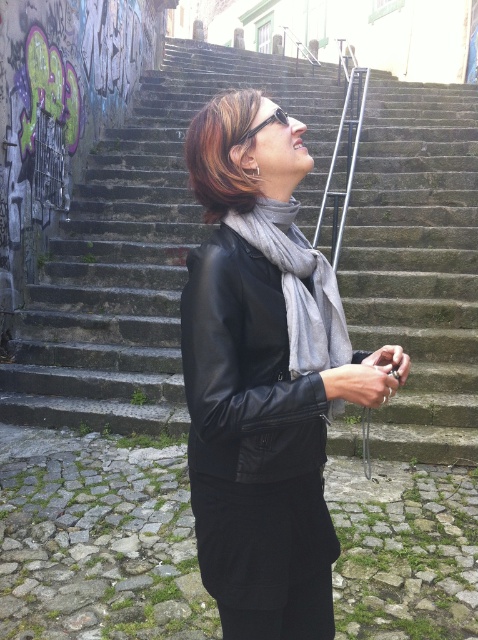
Who is higher up, concrete steps at center or black leather jacket at center?

concrete steps at center

Is point (167, 156) behind point (198, 189)?

Yes, point (167, 156) is farther from viewer.

I want to click on concrete steps at center, so click(142, 250).

Does black leather jacket at center have a larger size compared to gray wool scarf at center?

Indeed, black leather jacket at center has a larger size compared to gray wool scarf at center.

Measure the distance between point (198, 184) and camera.

1.41 meters

Between point (302, 292) and point (325, 330), which one is positioned in front?

Point (302, 292) is more forward.

Locate an element on the screen. This screenshot has width=478, height=640. black leather jacket at center is located at coordinates (263, 376).

In order to click on concrete steps at center in this screenshot , I will do `click(142, 250)`.

How much distance is there between concrete steps at center and gray wool scarf at center?

13.99 feet

Is point (99, 365) positioned before point (336, 323)?

No, (99, 365) is further to viewer.

At what (x,y) coordinates should I click in order to perform the action: click on concrete steps at center. Please return your answer as a coordinate pair (x, y). Looking at the image, I should click on (142, 250).